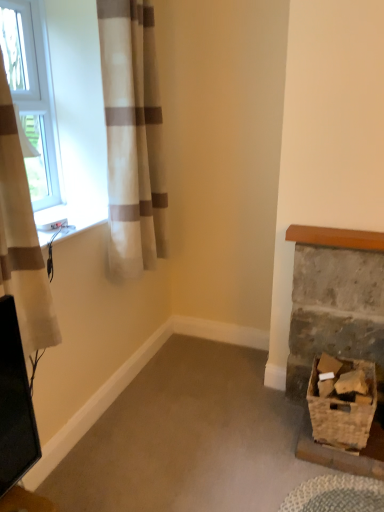
Question: Considering the relative positions of woven brown basket at lower right and white plastic window at upper left in the image provided, is woven brown basket at lower right to the left of white plastic window at upper left from the viewer's perspective?

Choices:
 (A) yes
 (B) no

Answer: (B)

Question: Is woven brown basket at lower right outside of white plastic window at upper left?

Choices:
 (A) no
 (B) yes

Answer: (B)

Question: From a real-world perspective, does woven brown basket at lower right stand above white plastic window at upper left?

Choices:
 (A) no
 (B) yes

Answer: (A)

Question: Can you confirm if woven brown basket at lower right is bigger than white plastic window at upper left?

Choices:
 (A) no
 (B) yes

Answer: (B)

Question: Considering the relative sizes of woven brown basket at lower right and white plastic window at upper left in the image provided, is woven brown basket at lower right smaller than white plastic window at upper left?

Choices:
 (A) yes
 (B) no

Answer: (B)

Question: Can you confirm if woven brown basket at lower right is thinner than white plastic window at upper left?

Choices:
 (A) yes
 (B) no

Answer: (B)

Question: Could you tell me if white plastic window at upper left is facing woven brown basket at lower right?

Choices:
 (A) yes
 (B) no

Answer: (A)

Question: Is white plastic window at upper left facing away from woven brown basket at lower right?

Choices:
 (A) no
 (B) yes

Answer: (A)

Question: Can you see white plastic window at upper left touching woven brown basket at lower right?

Choices:
 (A) no
 (B) yes

Answer: (A)

Question: Considering the relative sizes of white plastic window at upper left and woven brown basket at lower right in the image provided, is white plastic window at upper left thinner than woven brown basket at lower right?

Choices:
 (A) yes
 (B) no

Answer: (A)

Question: From the image's perspective, is white plastic window at upper left located beneath woven brown basket at lower right?

Choices:
 (A) yes
 (B) no

Answer: (B)

Question: Is white plastic window at upper left bigger than woven brown basket at lower right?

Choices:
 (A) yes
 (B) no

Answer: (B)

Question: Is white textured curtain at left, acting as the 1th curtain starting from the left, facing towards white plastic window at upper left?

Choices:
 (A) no
 (B) yes

Answer: (A)